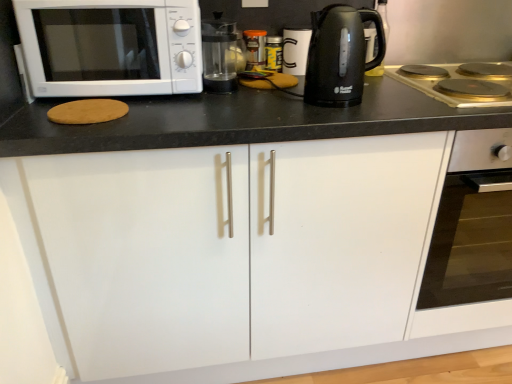
Identify the location of free location in front of transparent glass coffee machine at center. (220, 104).